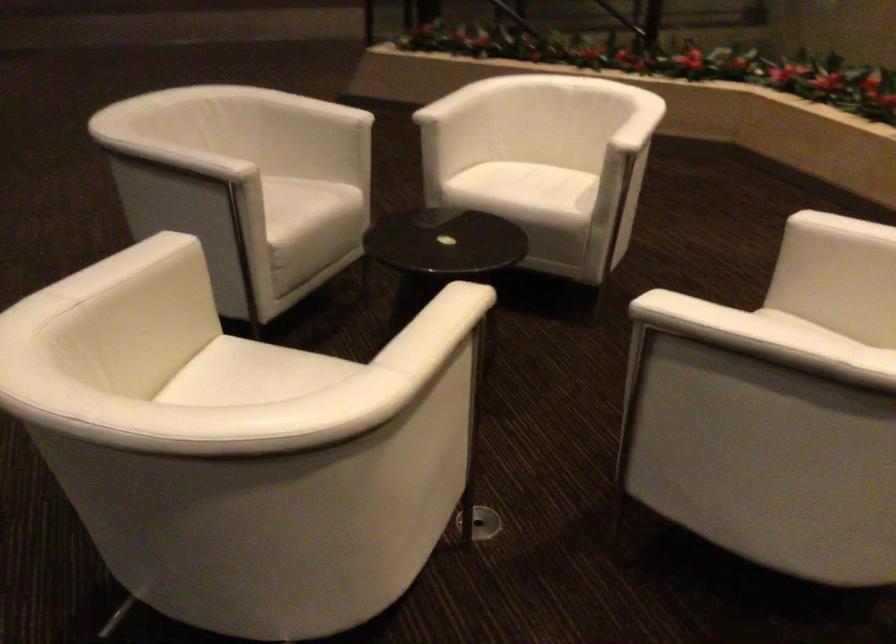
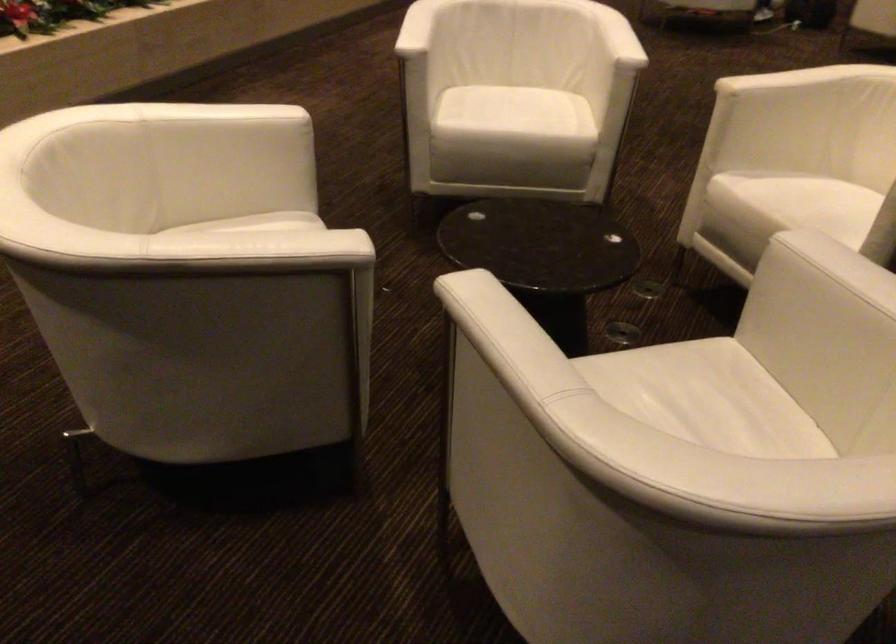
In the second image, find the point that corresponds to [321,371] in the first image.

(794, 198)